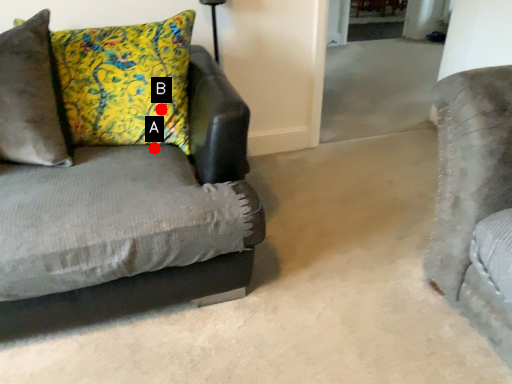
Question: Two points are circled on the image, labeled by A and B beside each circle. Among these points, which one is nearest to the camera?

Choices:
 (A) A is closer
 (B) B is closer

Answer: (B)